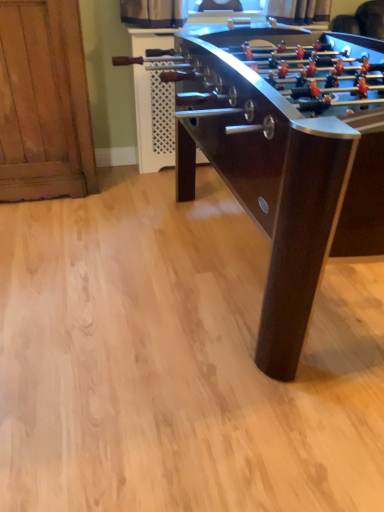
Locate an element on the screen. The width and height of the screenshot is (384, 512). unoccupied area in front of wooden cabinet at left is located at coordinates (49, 224).